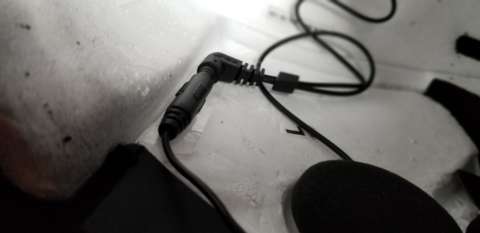
This screenshot has height=233, width=480. I want to click on plug, so click(206, 73).